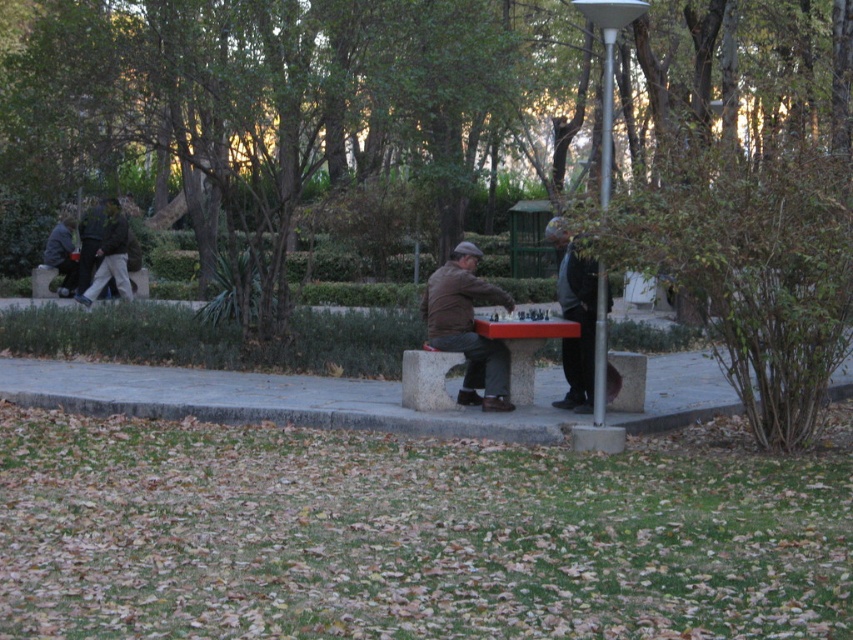
You are planning to place a bench in the park so that it is exactly 40 feet away from the red plastic table at center. Based on the current placement of the wooden bench at center, is the bench placed correctly?

The wooden bench at center is currently 40.74 feet away from the red plastic table at center, which is slightly more than the desired 40 feet. Therefore, the bench is not placed correctly as it needs to be moved 0.74 feet closer to the red plastic table at center to meet the requirement.

You are a tailor measuring jackets for alterations. You have two jackets in front of you, the brown leather jacket at center and the dark brown leather jacket at left. Which jacket requires a wider table surface to lay out completely?

The dark brown leather jacket at left requires a wider table surface because its width is greater than the brown leather jacket at center.

Based on the photo, you are a person who is 1.7 meters tall. You want to sit on the wooden bench at center and play chess on the red plastic table at center. Will your feet touch the ground when sitting?

The red plastic table at center is much taller than the wooden bench at center. Since the table is taller, the bench is shorter, so when sitting on the wooden bench at center, your feet will likely touch the ground.